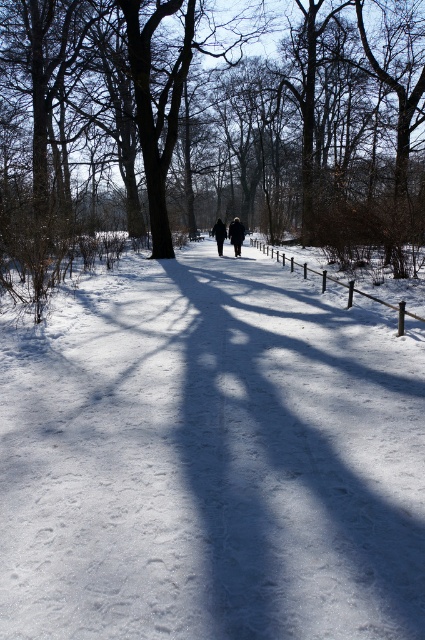
Question: Is brown bark tree at center above black fabric at center?

Choices:
 (A) yes
 (B) no

Answer: (A)

Question: Estimate the real-world distances between objects in this image. Which object is farther from the black fabric at center?

Choices:
 (A) brown bark tree at center
 (B) white snow at center

Answer: (B)

Question: Does dark blue coat at center appear under black fabric at center?

Choices:
 (A) yes
 (B) no

Answer: (A)

Question: Which object is farther from the camera taking this photo?

Choices:
 (A) brown bark tree at center
 (B) white snow at center

Answer: (A)

Question: Estimate the real-world distances between objects in this image. Which object is closer to the white snow at center?

Choices:
 (A) dark blue coat at center
 (B) black fabric at center

Answer: (A)

Question: Is brown bark tree at center to the right of black fabric at center from the viewer's perspective?

Choices:
 (A) no
 (B) yes

Answer: (A)